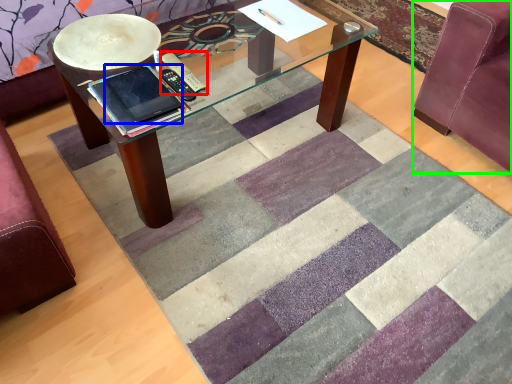
Question: Considering the real-world distances, which object is closest to remote (highlighted by a red box)? ipad (highlighted by a blue box) or swivel chair (highlighted by a green box).

Choices:
 (A) ipad
 (B) swivel chair

Answer: (A)